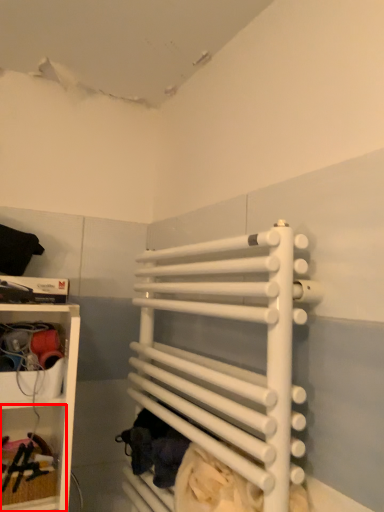
Question: From the image's perspective, where is cabinet (annotated by the red box) located relative to bunk bed?

Choices:
 (A) below
 (B) above

Answer: (A)